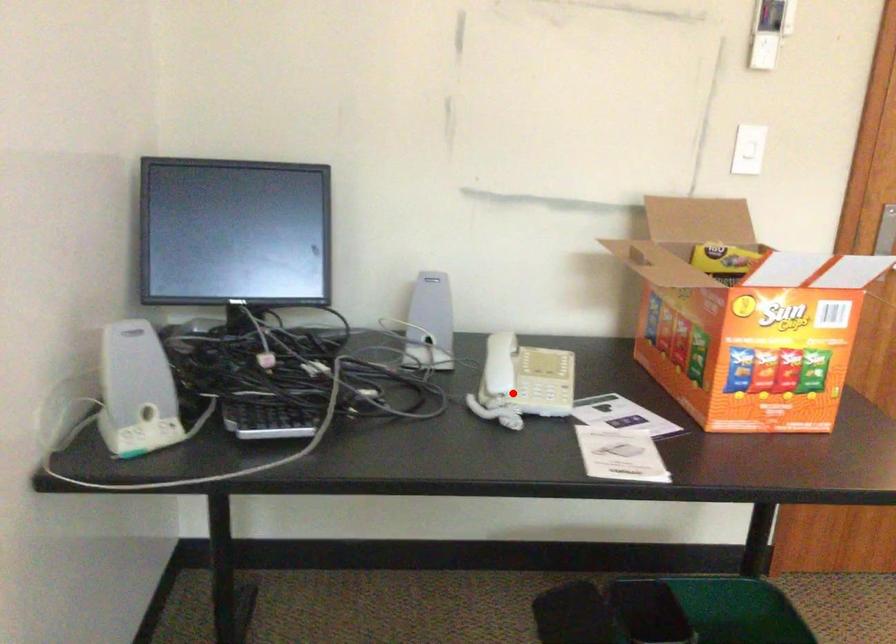
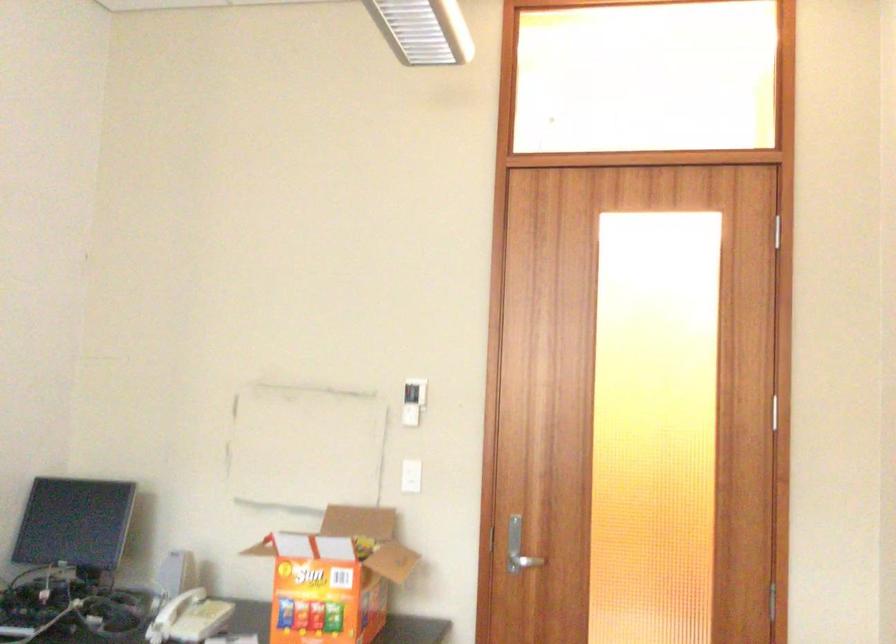
Locate, in the second image, the point that corresponds to the highlighted location in the first image.

(170, 617)